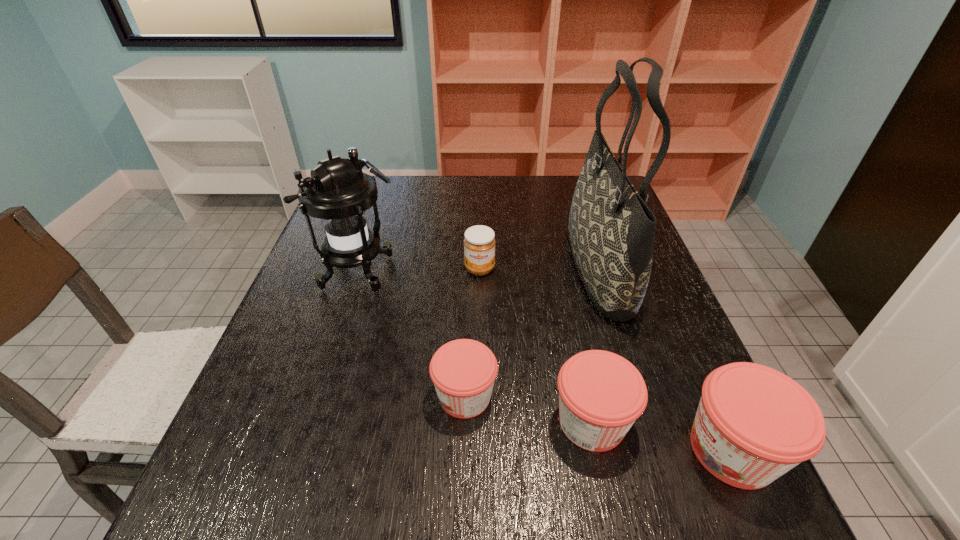
In order to click on the second jam from right to left in this screenshot , I will do `click(601, 394)`.

The image size is (960, 540). Find the location of `the rightmost jam`. the rightmost jam is located at coordinates (753, 424).

Where is `the farthest jam`? This screenshot has height=540, width=960. the farthest jam is located at coordinates (479, 243).

At what (x,y) coordinates should I click in order to perform the action: click on the tallest object. Please return your answer as a coordinate pair (x, y). Image resolution: width=960 pixels, height=540 pixels. Looking at the image, I should click on (611, 230).

I want to click on the leftmost object, so click(x=338, y=192).

This screenshot has height=540, width=960. Find the location of `lantern`. lantern is located at coordinates (338, 192).

Locate an element on the screen. The image size is (960, 540). vacant space positioned 0.130m on the front label of the third jam from left to right is located at coordinates (703, 422).

Locate an element on the screen. This screenshot has height=540, width=960. vacant space located on the front label of the rightmost jam is located at coordinates (614, 450).

Locate an element on the screen. The image size is (960, 540). vacant space located on the front label of the rightmost jam is located at coordinates (654, 450).

You are a GUI agent. You are given a task and a screenshot of the screen. Output one action in this format:
    pyautogui.click(x=<x>, y=<y>)
    Task: Click on the vacant point located on the front label of the rightmost jam
    
    Given the screenshot: What is the action you would take?
    pyautogui.click(x=642, y=450)